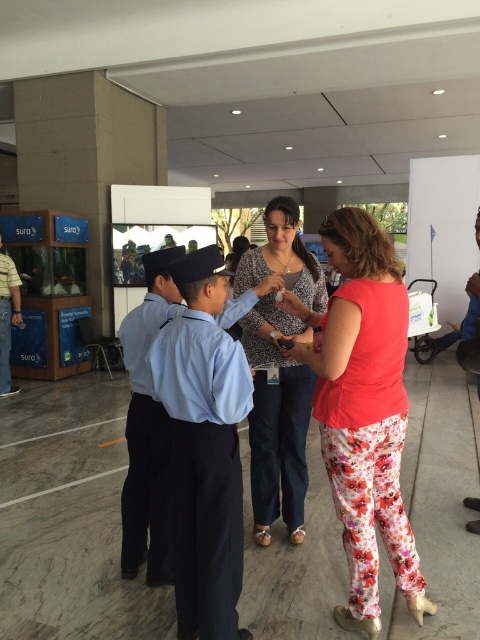
Can you confirm if floral cotton pants at center is taller than light blue uniform at center?

Correct, floral cotton pants at center is much taller as light blue uniform at center.

Does floral cotton pants at center have a smaller size compared to light blue uniform at center?

Actually, floral cotton pants at center might be larger than light blue uniform at center.

Does point (399, 416) lie in front of point (237, 384)?

No, it is behind (237, 384).

The height and width of the screenshot is (640, 480). Find the location of `floral cotton pants at center`. floral cotton pants at center is located at coordinates (363, 410).

Does floral cotton pants at center appear on the left side of floral pants at center?

No, floral cotton pants at center is not to the left of floral pants at center.

The width and height of the screenshot is (480, 640). In order to click on floral cotton pants at center in this screenshot , I will do `click(363, 410)`.

Is point (205, 275) in front of point (267, 458)?

Yes.

Does light blue uniform at center have a larger size compared to floral pants at center?

Incorrect, light blue uniform at center is not larger than floral pants at center.

Between point (183, 298) and point (302, 444), which one is positioned in front?

Positioned in front is point (183, 298).

Image resolution: width=480 pixels, height=640 pixels. Identify the location of light blue uniform at center. (204, 448).